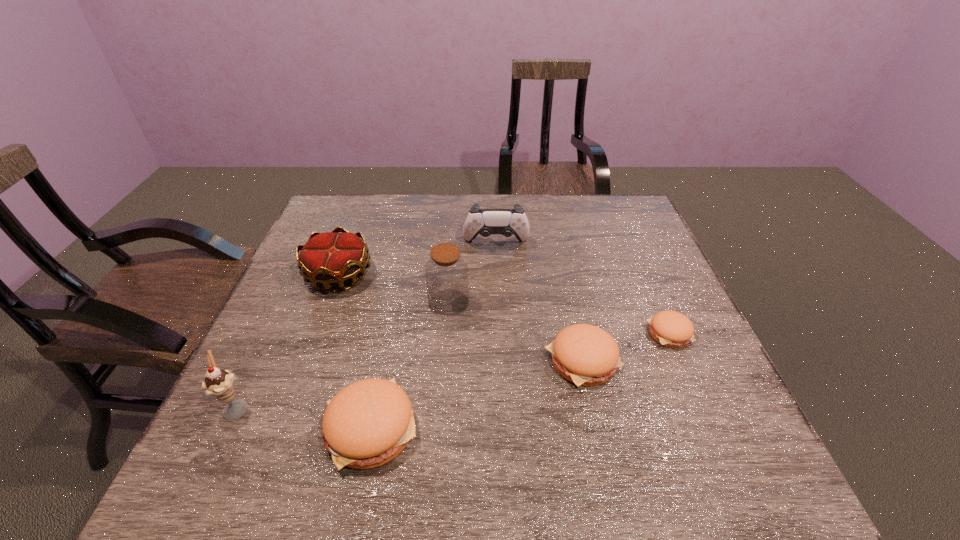
Please mark a free spot for a new patty_(food) to balance the arrangement. Please provide its 2D coordinates. Your answer should be formatted as a tuple, i.e. [(x, y)], where the tuple contains the x and y coordinates of a point satisfying the conditions above.

[(484, 392)]